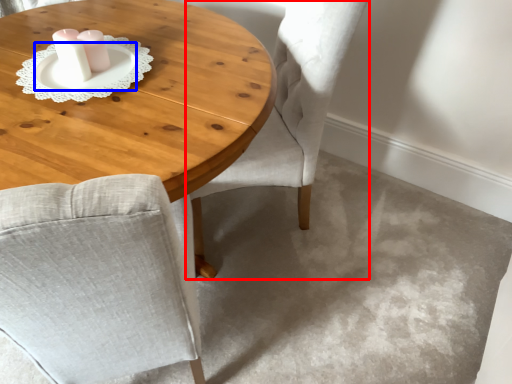
Question: Which of the following is the farthest to the observer, chair (highlighted by a red box) or saucer (highlighted by a blue box)?

Choices:
 (A) chair
 (B) saucer

Answer: (B)